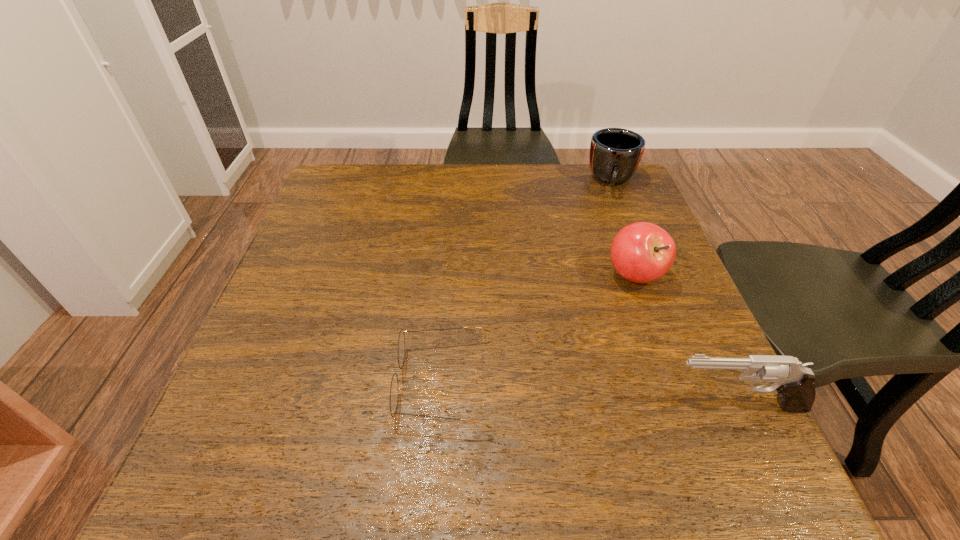
Locate an element on the screen. This screenshot has height=540, width=960. vacant space in between the apple and the leftmost object is located at coordinates (539, 328).

This screenshot has width=960, height=540. I want to click on unoccupied area between the gun and the mug, so click(674, 293).

Identify the location of empty space between the leftmost object and the apple. (539, 328).

Where is `empty location between the mug and the spectacles`? empty location between the mug and the spectacles is located at coordinates (528, 281).

Find the location of a particular element. The width and height of the screenshot is (960, 540). vacant area between the mug and the shortest object is located at coordinates (528, 281).

At what (x,y) coordinates should I click in order to perform the action: click on free spot between the farthest object and the gun. Please return your answer as a coordinate pair (x, y). Image resolution: width=960 pixels, height=540 pixels. Looking at the image, I should click on (674, 293).

You are a GUI agent. You are given a task and a screenshot of the screen. Output one action in this format:
    pyautogui.click(x=<x>, y=<y>)
    Task: Click on the free space between the gun and the second farthest object
    The width and height of the screenshot is (960, 540).
    Given the screenshot: What is the action you would take?
    pyautogui.click(x=685, y=340)

Where is `object that can be found as the second closest to the gun`? The height and width of the screenshot is (540, 960). object that can be found as the second closest to the gun is located at coordinates (394, 389).

Where is `object identified as the closest to the gun`? The width and height of the screenshot is (960, 540). object identified as the closest to the gun is located at coordinates pos(641,252).

Where is `free space that satisfies the following two spatial constraints: 1. on the front side of the third nearest object; 2. at the muzzle of the gun`? free space that satisfies the following two spatial constraints: 1. on the front side of the third nearest object; 2. at the muzzle of the gun is located at coordinates point(683,405).